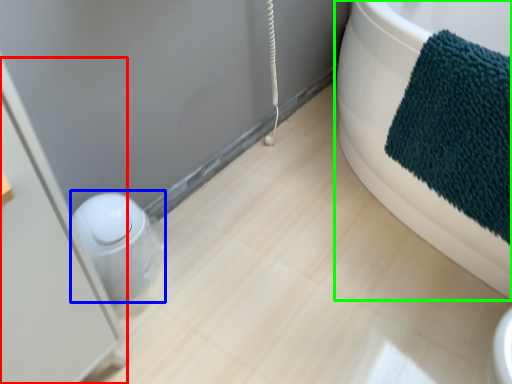
Question: Which object is the closest to the screen door (highlighted by a red box)? Choose among these: toilet bowl (highlighted by a blue box) or bathtub (highlighted by a green box).

Choices:
 (A) toilet bowl
 (B) bathtub

Answer: (A)